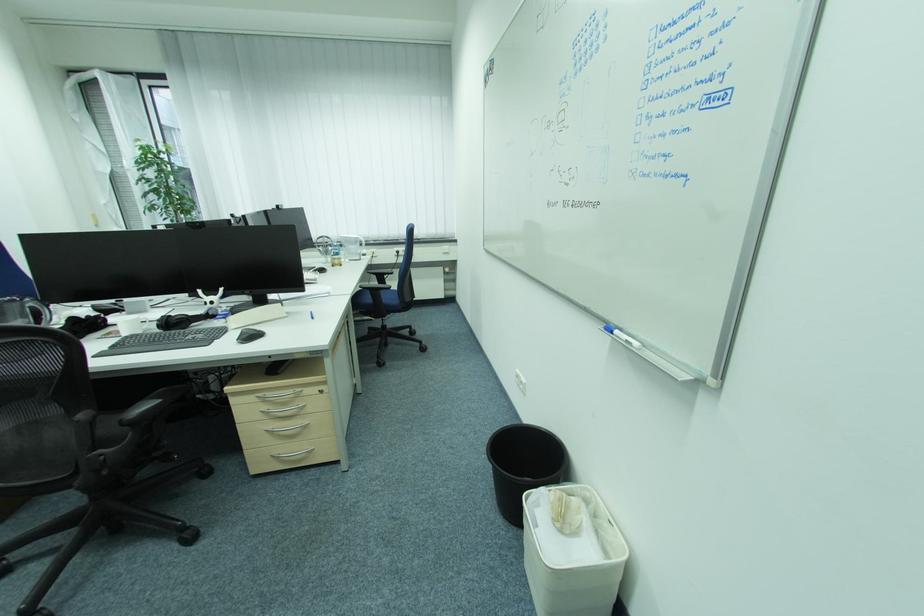
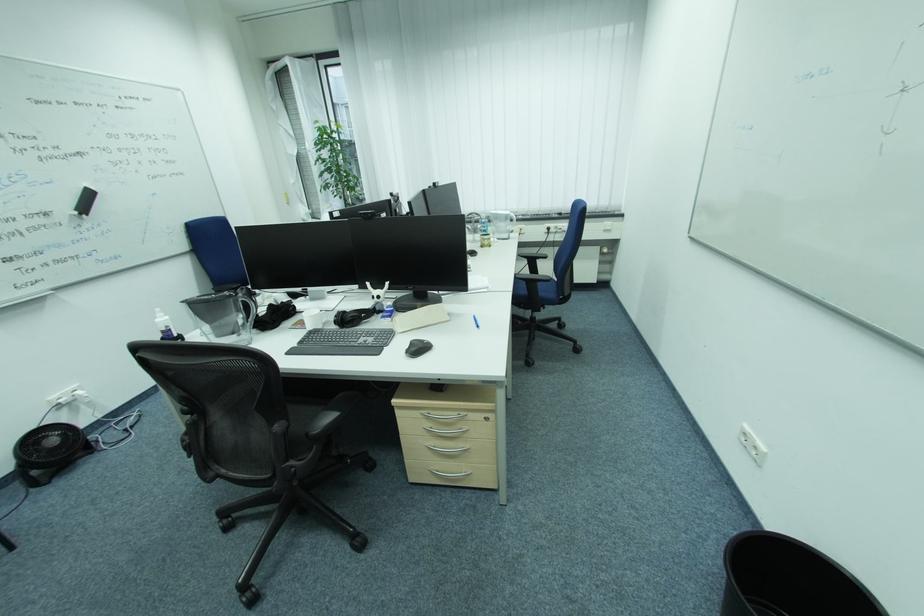
Find the pixel in the second image that matches point (30, 301) in the first image.

(242, 294)